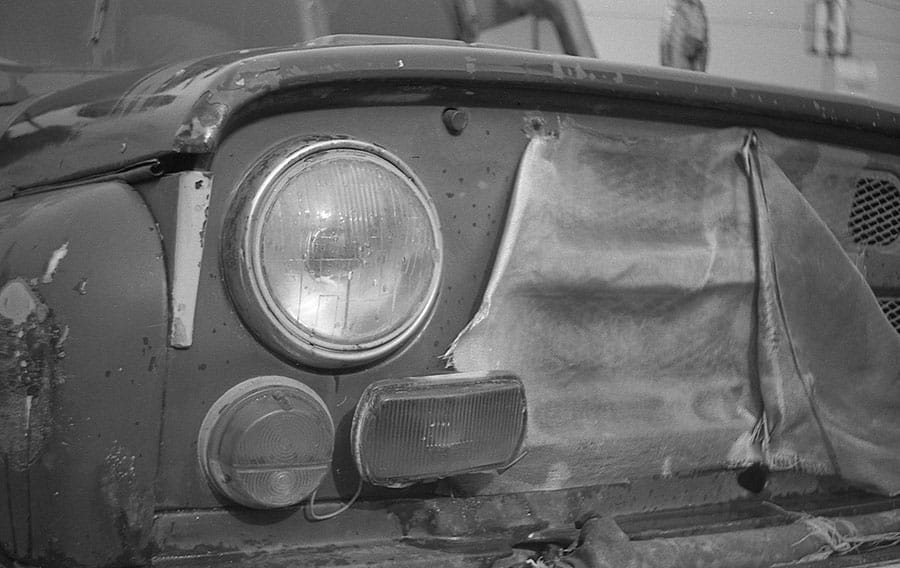
What are the coordinates of `mirror` in the screenshot? It's located at [x=698, y=51].